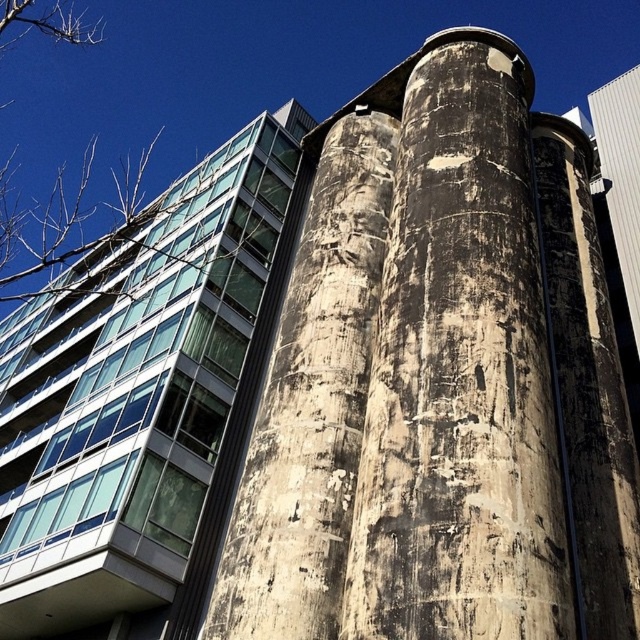
In the scene shown: Is concrete textured tower at center shorter than weathered concrete pillar at center?

Incorrect, concrete textured tower at center's height does not fall short of weathered concrete pillar at center's.

Is concrete textured tower at center below weathered concrete pillar at center?

Yes, concrete textured tower at center is below weathered concrete pillar at center.

Where is `concrete textured tower at center`? The height and width of the screenshot is (640, 640). concrete textured tower at center is located at coordinates (177, 417).

This screenshot has width=640, height=640. I want to click on concrete textured tower at center, so click(x=177, y=417).

Does concrete textured tower at center have a lesser width compared to weathered concrete silo at center?

No.

Between concrete textured tower at center and weathered concrete silo at center, which one has less height?

Standing shorter between the two is weathered concrete silo at center.

Is point (276, 349) farther from viewer compared to point (477, 488)?

Yes, it is behind point (477, 488).

I want to click on concrete textured tower at center, so pos(177,417).

Is weathered concrete silo at center to the right of weathered concrete pillar at center from the viewer's perspective?

Indeed, weathered concrete silo at center is positioned on the right side of weathered concrete pillar at center.

Locate an element on the screen. The height and width of the screenshot is (640, 640). weathered concrete silo at center is located at coordinates point(460,374).

Is point (419, 200) closer to camera compared to point (310, 188)?

Yes, point (419, 200) is in front of point (310, 188).

Locate an element on the screen. Image resolution: width=640 pixels, height=640 pixels. weathered concrete silo at center is located at coordinates (460, 374).